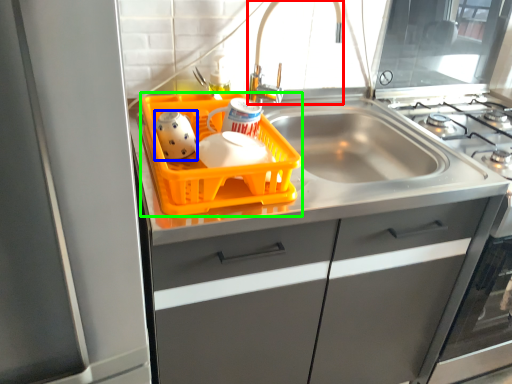
Question: Which object is the farthest from faucet (highlighted by a red box)? Choose among these: tea pot (highlighted by a blue box) or basket (highlighted by a green box).

Choices:
 (A) tea pot
 (B) basket

Answer: (A)